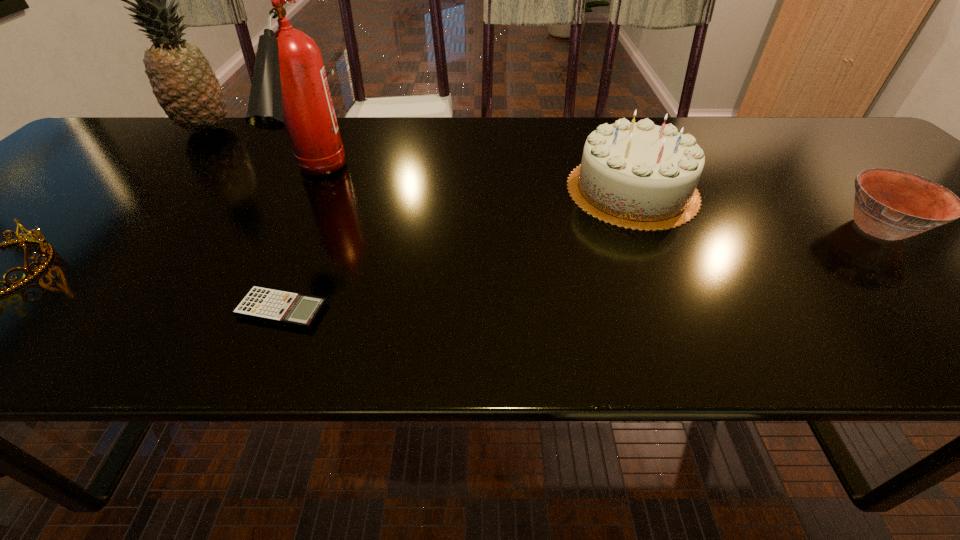
Image resolution: width=960 pixels, height=540 pixels. In the image, there is a desktop. Identify the location of free space at the far left corner. (137, 137).

This screenshot has width=960, height=540. What are the coordinates of `vacant region at the far right corner` in the screenshot? It's located at (820, 153).

Where is `free space between the shortest object and the fire extinguisher`? The height and width of the screenshot is (540, 960). free space between the shortest object and the fire extinguisher is located at coordinates 299,246.

Identify the location of vacant area that lies between the birthday cake and the calculator. (457, 250).

The height and width of the screenshot is (540, 960). I want to click on free spot between the bowl and the farthest object, so click(542, 179).

You are a GUI agent. You are given a task and a screenshot of the screen. Output one action in this format:
    pyautogui.click(x=<x>, y=<y>)
    Task: Click on the blank region between the rightmost object and the fourth shortest object
    This screenshot has width=960, height=540.
    Given the screenshot: What is the action you would take?
    pyautogui.click(x=756, y=210)

This screenshot has height=540, width=960. Identify the location of vacant point located between the rightmost object and the birthday cake. (756, 210).

Identify the location of free space between the fire extinguisher and the birthday cake. (474, 186).

You are a GUI agent. You are given a task and a screenshot of the screen. Output one action in this format:
    pyautogui.click(x=<x>, y=<y>)
    Task: Click on the unoccupied position between the second object from right to left and the fire extinguisher
    This screenshot has height=540, width=960.
    Given the screenshot: What is the action you would take?
    pyautogui.click(x=474, y=186)

Find the location of a particular element. This screenshot has height=540, width=960. vacant space that is in between the farthest object and the fire extinguisher is located at coordinates (261, 156).